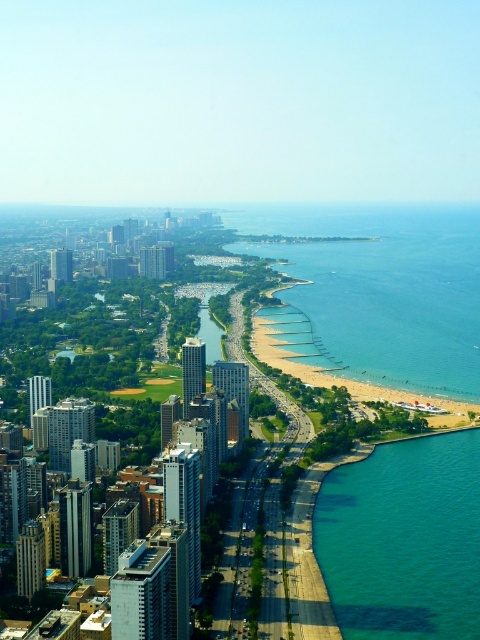
Question: Is clear blue water at lower right above teal glassy water at lower right?

Choices:
 (A) no
 (B) yes

Answer: (B)

Question: Which point is farther from the camera taking this photo?

Choices:
 (A) (357, 620)
 (B) (317, 323)

Answer: (A)

Question: Is clear blue water at lower right closer to the viewer compared to teal glassy water at lower right?

Choices:
 (A) no
 (B) yes

Answer: (B)

Question: Is clear blue water at lower right bigger than teal glassy water at lower right?

Choices:
 (A) yes
 (B) no

Answer: (A)